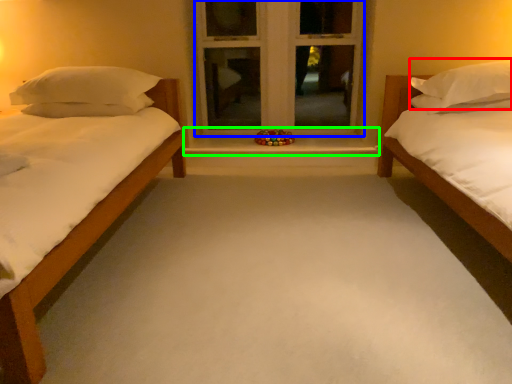
Question: Estimate the real-world distances between objects in this image. Which object is closer to pillow (highlighted by a red box), window frame (highlighted by a blue box) or window sill (highlighted by a green box)?

Choices:
 (A) window frame
 (B) window sill

Answer: (B)